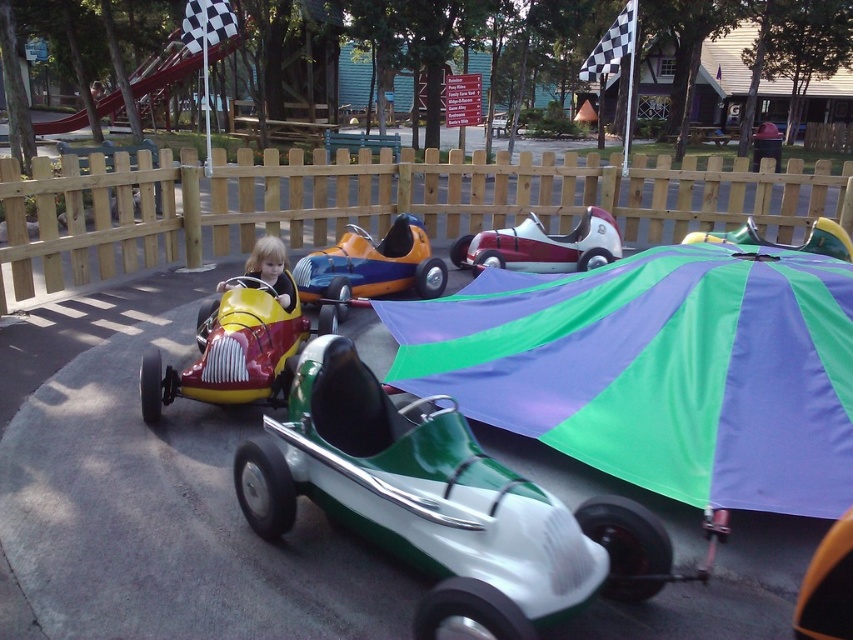
Does shiny orange and blue car at center have a larger size compared to metallic silver car at center?

Correct, shiny orange and blue car at center is larger in size than metallic silver car at center.

Is point (369, 250) behind point (610, 250)?

No, it is not.

Who is more distant from viewer, [345,276] or [607,253]?

Point [607,253]

The height and width of the screenshot is (640, 853). Identify the location of shiny orange and blue car at center. (372, 264).

Who is lower down, shiny green and white car at center or shiny red toy car at center?

shiny green and white car at center is below.

Is shiny green and white car at center smaller than shiny red toy car at center?

Actually, shiny green and white car at center might be larger than shiny red toy car at center.

Between point (445, 577) and point (294, 344), which one is positioned in front?

Point (445, 577)

Identify the location of shiny green and white car at center. This screenshot has height=640, width=853. (440, 502).

Can you confirm if green and purple striped umbrella at center is positioned above shiny orange and blue car at center?

No, green and purple striped umbrella at center is not above shiny orange and blue car at center.

Between green and purple striped umbrella at center and shiny orange and blue car at center, which one is positioned lower?

green and purple striped umbrella at center is below.

Is point (695, 284) positioned in front of point (428, 292)?

Yes, it is.

Identify the location of green and purple striped umbrella at center. (659, 369).